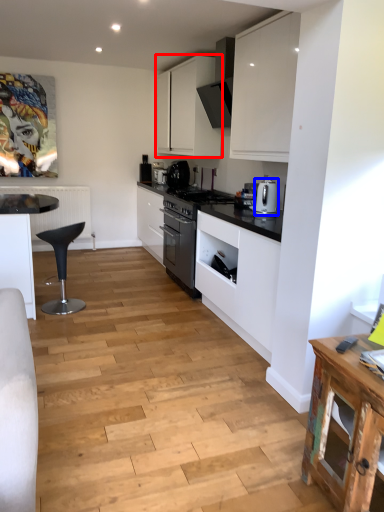
Question: Which object appears farthest to the camera in this image, cabinetry (highlighted by a red box) or kitchen appliance (highlighted by a blue box)?

Choices:
 (A) cabinetry
 (B) kitchen appliance

Answer: (A)